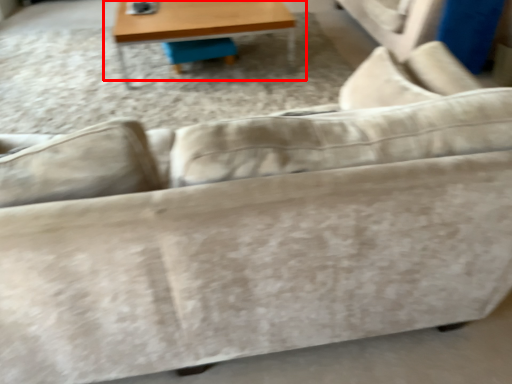
Question: From the image's perspective, where is table (annotated by the red box) located relative to swivel chair?

Choices:
 (A) below
 (B) above

Answer: (B)